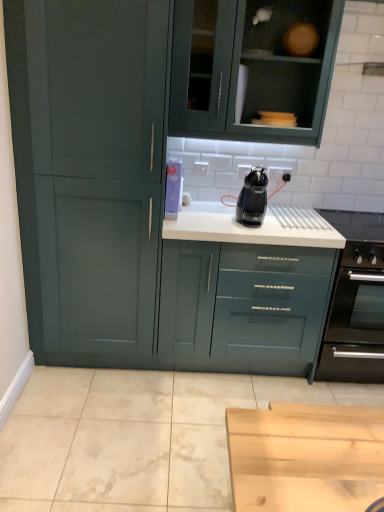
Question: Is matte green cupboard at left not within black plastic coffee machine at center?

Choices:
 (A) no
 (B) yes

Answer: (B)

Question: From the image's perspective, is matte green cupboard at left beneath black plastic coffee machine at center?

Choices:
 (A) yes
 (B) no

Answer: (B)

Question: Considering the relative sizes of matte green cupboard at left and black plastic coffee machine at center in the image provided, is matte green cupboard at left bigger than black plastic coffee machine at center?

Choices:
 (A) yes
 (B) no

Answer: (A)

Question: Considering the relative positions of matte green cupboard at left and black plastic coffee machine at center in the image provided, is matte green cupboard at left to the right of black plastic coffee machine at center from the viewer's perspective?

Choices:
 (A) yes
 (B) no

Answer: (B)

Question: Is black plastic coffee machine at center a part of matte green cupboard at left?

Choices:
 (A) no
 (B) yes

Answer: (A)

Question: Is black matte oven at right wider or thinner than matte green cupboard at left?

Choices:
 (A) thin
 (B) wide

Answer: (B)

Question: Do you think black matte oven at right is within matte green cupboard at left, or outside of it?

Choices:
 (A) inside
 (B) outside

Answer: (B)

Question: Considering their positions, is black matte oven at right located in front of or behind matte green cupboard at left?

Choices:
 (A) front
 (B) behind

Answer: (B)

Question: From a real-world perspective, is black matte oven at right above or below matte green cupboard at left?

Choices:
 (A) above
 (B) below

Answer: (B)

Question: Is matte green cupboard at left bigger or smaller than matte green cabinet at upper center?

Choices:
 (A) big
 (B) small

Answer: (A)

Question: From their relative heights in the image, would you say matte green cupboard at left is taller or shorter than matte green cabinet at upper center?

Choices:
 (A) short
 (B) tall

Answer: (B)

Question: Would you say matte green cupboard at left is inside or outside matte green cabinet at upper center?

Choices:
 (A) inside
 (B) outside

Answer: (B)

Question: From the image's perspective, relative to matte green cabinet at upper center, is matte green cupboard at left above or below?

Choices:
 (A) below
 (B) above

Answer: (A)

Question: Is black plastic coffee machine at center wider or thinner than matte green cupboard at left?

Choices:
 (A) wide
 (B) thin

Answer: (B)

Question: Considering the relative positions of black plastic coffee machine at center and matte green cupboard at left in the image provided, is black plastic coffee machine at center to the left or to the right of matte green cupboard at left?

Choices:
 (A) left
 (B) right

Answer: (B)